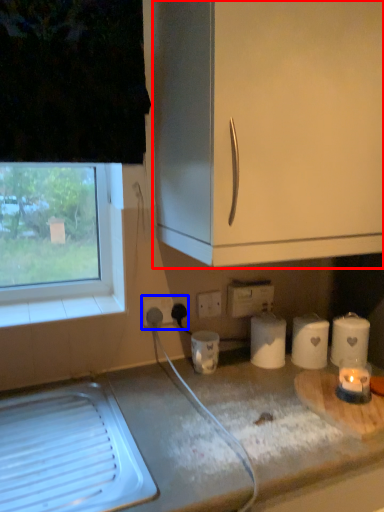
Question: Which of the following is the closest to the observer, cabinetry (highlighted by a red box) or electric outlet (highlighted by a blue box)?

Choices:
 (A) cabinetry
 (B) electric outlet

Answer: (A)